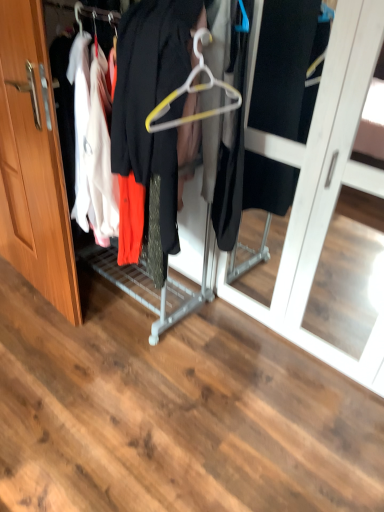
Question: Is metallic hanger at center not near wooden door at left?

Choices:
 (A) no
 (B) yes

Answer: (A)

Question: Does metallic hanger at center have a lesser height compared to wooden door at left?

Choices:
 (A) yes
 (B) no

Answer: (A)

Question: Is metallic hanger at center smaller than wooden door at left?

Choices:
 (A) yes
 (B) no

Answer: (B)

Question: Considering the relative sizes of metallic hanger at center and wooden door at left in the image provided, is metallic hanger at center thinner than wooden door at left?

Choices:
 (A) yes
 (B) no

Answer: (B)

Question: Is metallic hanger at center behind wooden door at left?

Choices:
 (A) no
 (B) yes

Answer: (A)

Question: Does metallic hanger at center appear on the right side of wooden door at left?

Choices:
 (A) yes
 (B) no

Answer: (A)

Question: Considering the relative sizes of wooden door at left and metallic hanger at center in the image provided, is wooden door at left thinner than metallic hanger at center?

Choices:
 (A) yes
 (B) no

Answer: (A)

Question: From a real-world perspective, is wooden door at left over metallic hanger at center?

Choices:
 (A) yes
 (B) no

Answer: (B)

Question: Does wooden door at left have a larger size compared to metallic hanger at center?

Choices:
 (A) yes
 (B) no

Answer: (B)

Question: Is wooden door at left far from metallic hanger at center?

Choices:
 (A) yes
 (B) no

Answer: (B)

Question: Is wooden door at left to the left of metallic hanger at center from the viewer's perspective?

Choices:
 (A) yes
 (B) no

Answer: (A)

Question: Could you tell me if wooden door at left is turned towards metallic hanger at center?

Choices:
 (A) no
 (B) yes

Answer: (A)

Question: Can you confirm if white plastic hanger at center is bigger than metallic hanger at center?

Choices:
 (A) no
 (B) yes

Answer: (A)